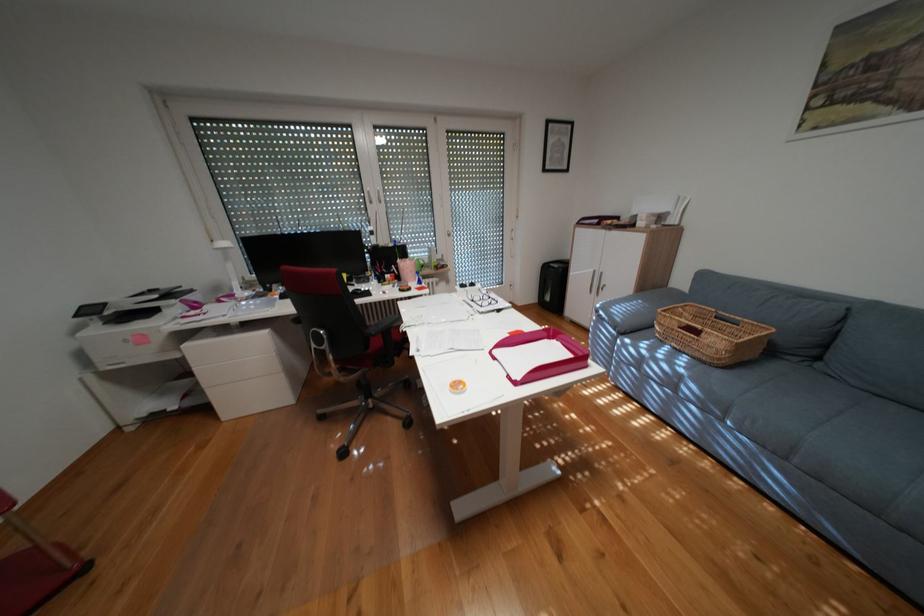
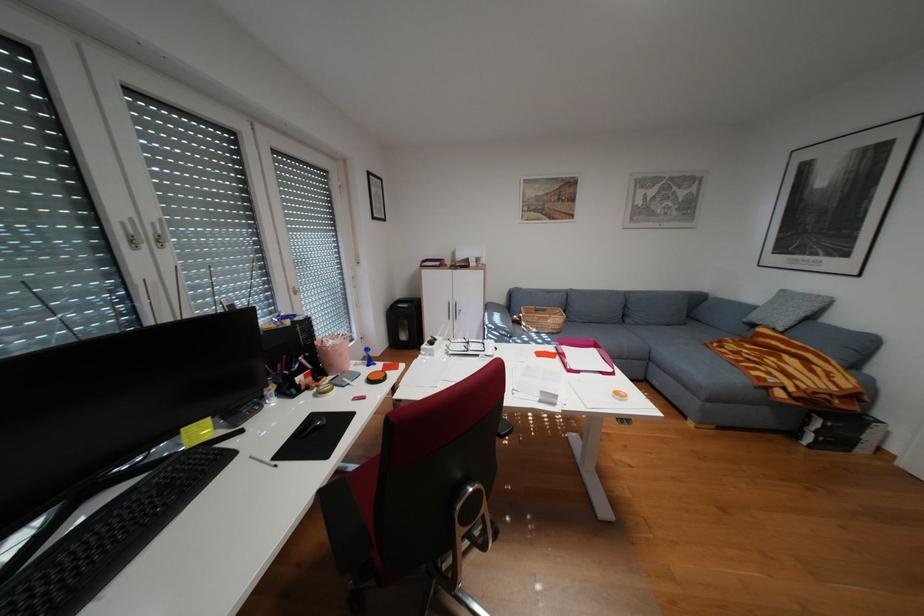
Locate, in the second image, the point that corresponds to point 622,221 in the first image.

(460, 262)